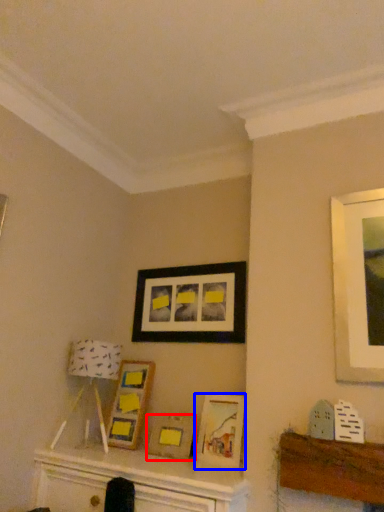
Question: Which point is further to the camera, picture frame (highlighted by a red box) or picture frame (highlighted by a blue box)?

Choices:
 (A) picture frame
 (B) picture frame

Answer: (A)